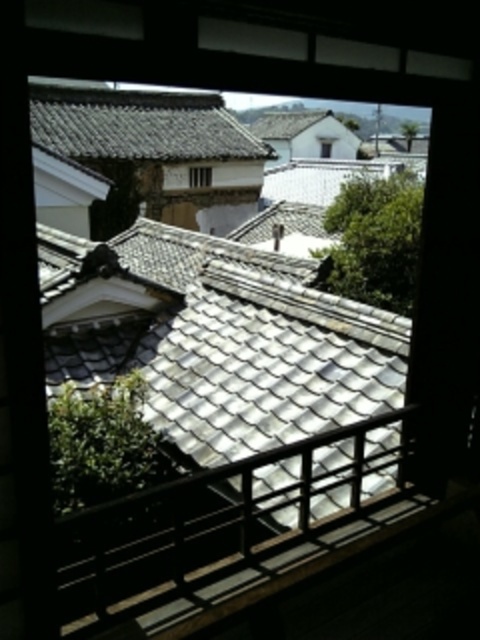
Question: Is the position of white glazed tiles at center less distant than that of transparent glass window at center?

Choices:
 (A) no
 (B) yes

Answer: (B)

Question: Does white glazed tiles at center appear under gray tile roof at upper center?

Choices:
 (A) no
 (B) yes

Answer: (B)

Question: Which is farther from the clear glass window at center?

Choices:
 (A) gray tile roof at upper center
 (B) white glazed tiles at center

Answer: (B)

Question: Which object is positioned farthest from the transparent glass window at center?

Choices:
 (A) clear glass window at center
 (B) gray tile roof at upper center
 (C) white glazed tiles at center

Answer: (C)

Question: Which object is closer to the camera taking this photo?

Choices:
 (A) gray tile roof at upper center
 (B) transparent glass window at center

Answer: (A)

Question: Does white glazed tiles at center have a lesser width compared to transparent glass window at center?

Choices:
 (A) yes
 (B) no

Answer: (B)